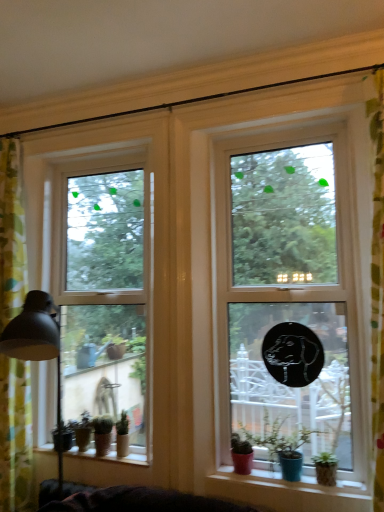
Where is `free space above smooth wooden window sill at lower left, the first window sill positioned from the left (from a real-world perspective)`? free space above smooth wooden window sill at lower left, the first window sill positioned from the left (from a real-world perspective) is located at coordinates (94, 451).